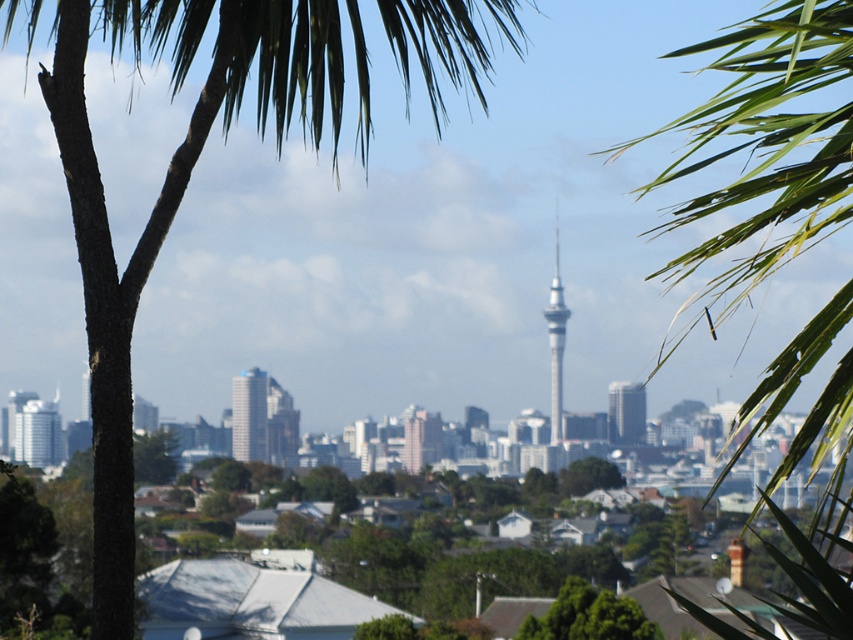
You are an architect designing a new garden area. You want to place a large statue between the green leafy palm tree at upper right and the silver metallic building at center. Based on their sizes, which object should the statue be closer to?

The green leafy palm tree at upper right is bigger than the silver metallic building at center, so the statue should be closer to the green leafy palm tree at upper right to maintain visual balance.

You are an architect designing a new building that needs to be visible from this scenic viewpoint. Considering the green leafy palm tree at upper right and the silver metallic building at center, which object is closer to the viewer and might block the view of the other?

The green leafy palm tree at upper right is in front of the silver metallic building at center, so it is closer to the viewer and could block the view of the silver metallic building at center.